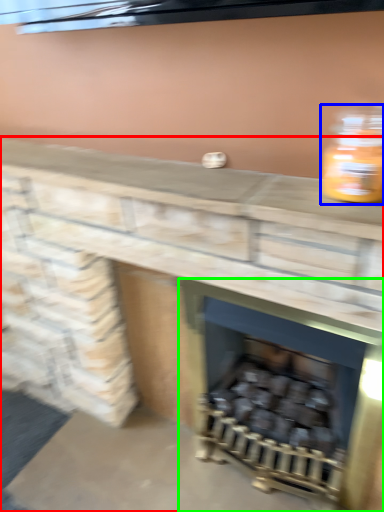
Question: Based on their relative distances, which object is nearer to fireplace (highlighted by a red box)? Choose from bottle (highlighted by a blue box) and wood burning stove (highlighted by a green box).

Choices:
 (A) bottle
 (B) wood burning stove

Answer: (B)